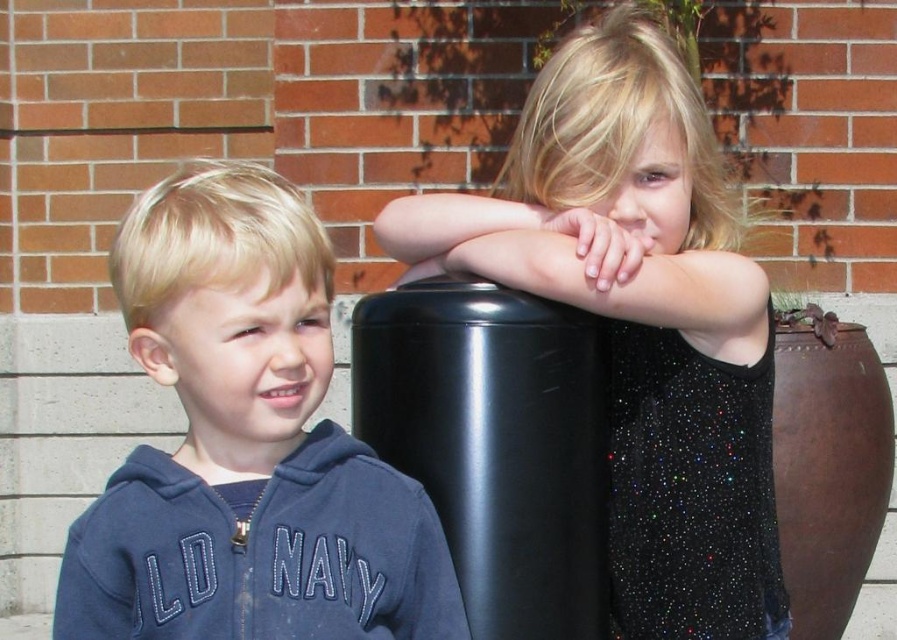
You are a photographer trying to capture both the sparkly black dress at upper right and the blue fleece hoodie at left in a single frame. Which clothing item requires more horizontal space in the camera frame?

The sparkly black dress at upper right requires more horizontal space in the camera frame because its width surpasses that of the blue fleece hoodie at left.

Based on the scene description, which clothing item is taller between the sparkly black dress at upper right and the navy fleece sweatshirt at left?

The sparkly black dress at upper right is taller than the navy fleece sweatshirt at left according to the description.

Consider the image. You are a photographer standing at the camera position. You want to take a photo of the boy on the left and the girl on the right. The focus point is set at point (x=309, y=596). Will the boy on the left and the girl on the right be in focus if the depth of field can cover 5 feet?

The distance of point (x=309, y=596) from camera is 4.74 feet. Since the depth of field can cover 5 feet, both the boy on the left and the girl on the right will be in focus.